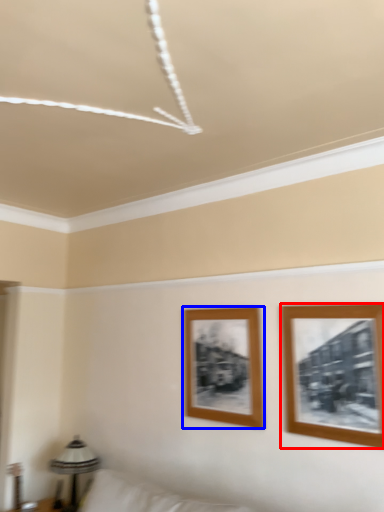
Question: Which object is closer to the camera taking this photo, picture frame (highlighted by a red box) or picture frame (highlighted by a blue box)?

Choices:
 (A) picture frame
 (B) picture frame

Answer: (A)